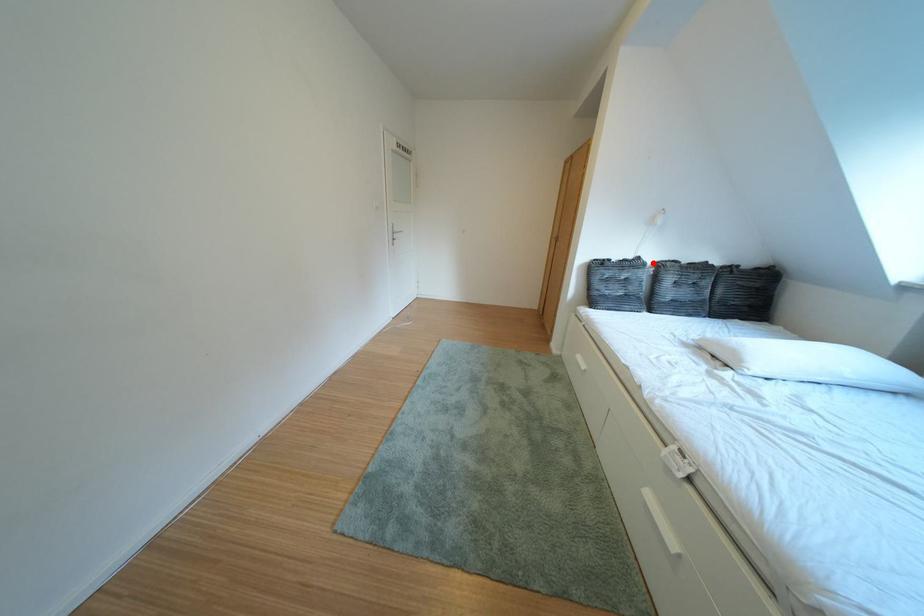
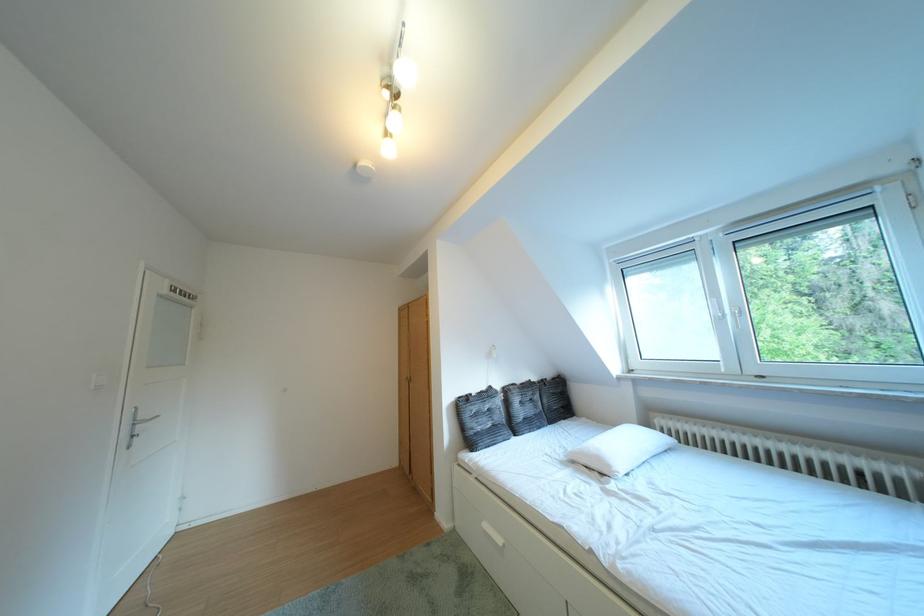
Question: I am providing you with two images of the same scene from different viewpoints. Given a red point in image1, look at the same physical point in image2. Is it:

Choices:
 (A) Closer to the viewpoint
 (B) Farther from the viewpoint

Answer: (B)